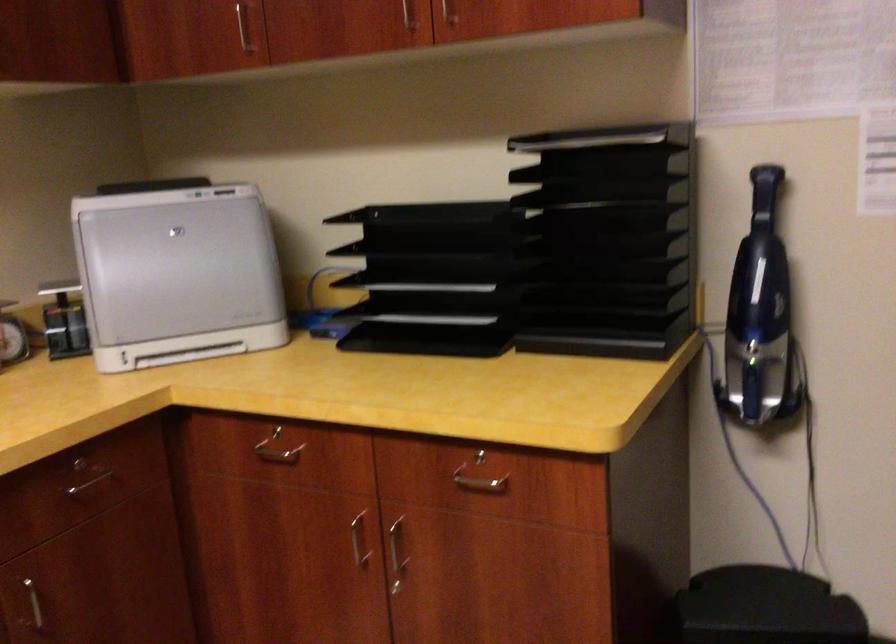
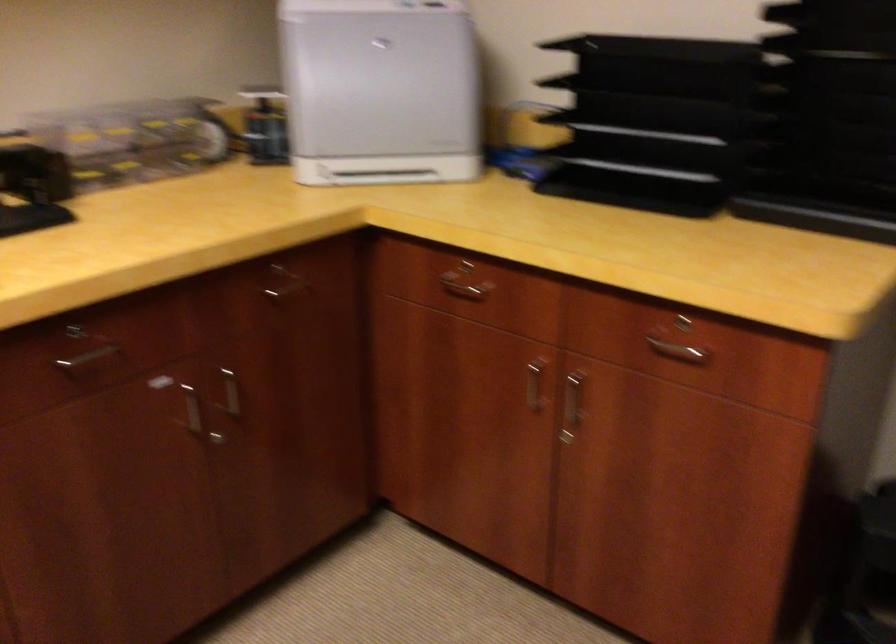
Find the pixel in the second image that matches (x=88, y=462) in the first image.

(282, 270)